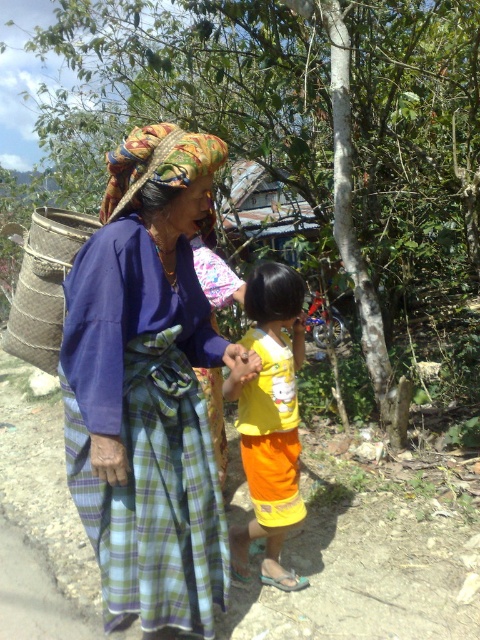
Question: From the image, what is the correct spatial relationship of plaid fabric headscarf at center in relation to natural woven basket at left?

Choices:
 (A) below
 (B) above

Answer: (A)

Question: Which point is farther from the camera taking this photo?

Choices:
 (A) (263, 307)
 (B) (27, 348)

Answer: (B)

Question: Based on their relative distances, which object is farther from the natural woven basket at left?

Choices:
 (A) plaid fabric headscarf at center
 (B) yellow matte shirt at center

Answer: (A)

Question: Does yellow matte shirt at center appear under natural woven basket at left?

Choices:
 (A) no
 (B) yes

Answer: (B)

Question: Does plaid fabric headscarf at center have a lesser width compared to yellow matte shirt at center?

Choices:
 (A) no
 (B) yes

Answer: (A)

Question: Which of the following is the closest to the observer?

Choices:
 (A) yellow matte shirt at center
 (B) plaid fabric headscarf at center
 (C) natural woven basket at left

Answer: (B)